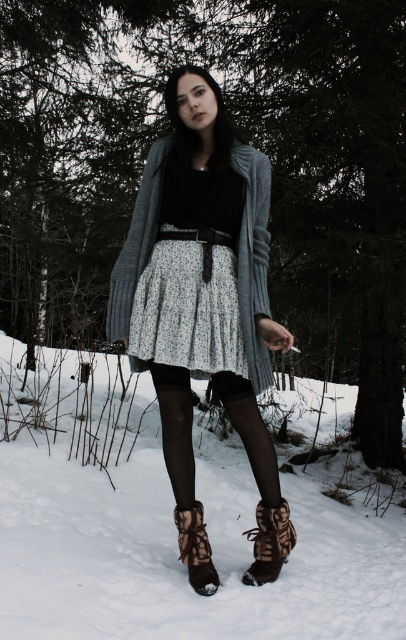
You are standing at the point with coordinates point (263, 532) and want to walk towards the point with coordinates point (161, 365). Which direction should you face to walk directly towards it?

You should face north to walk directly towards point (161, 365) from point (263, 532).